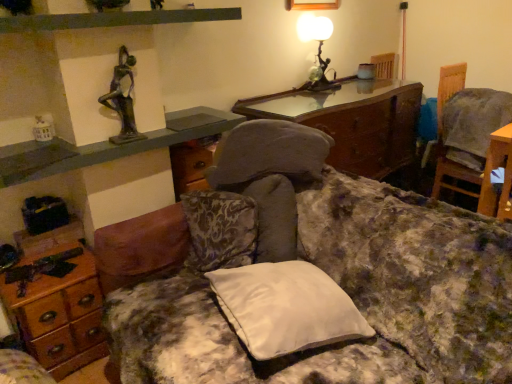
Question: Is fluffy fabric couch at center positioned before matte black shelf at upper left?

Choices:
 (A) yes
 (B) no

Answer: (A)

Question: Is matte black shelf at upper left at the back of fluffy fabric couch at center?

Choices:
 (A) yes
 (B) no

Answer: (B)

Question: Can you confirm if fluffy fabric couch at center is shorter than matte black shelf at upper left?

Choices:
 (A) no
 (B) yes

Answer: (A)

Question: Is fluffy fabric couch at center further to the viewer compared to matte black shelf at upper left?

Choices:
 (A) yes
 (B) no

Answer: (B)

Question: From a real-world perspective, does fluffy fabric couch at center sit lower than matte black shelf at upper left?

Choices:
 (A) yes
 (B) no

Answer: (A)

Question: Can you confirm if fluffy fabric couch at center is smaller than matte black shelf at upper left?

Choices:
 (A) no
 (B) yes

Answer: (A)

Question: Can you confirm if wooden desk at lower left is wider than matte glass table lamp at upper right?

Choices:
 (A) yes
 (B) no

Answer: (A)

Question: Can you confirm if wooden desk at lower left is thinner than matte glass table lamp at upper right?

Choices:
 (A) yes
 (B) no

Answer: (B)

Question: Is wooden desk at lower left outside matte glass table lamp at upper right?

Choices:
 (A) yes
 (B) no

Answer: (A)

Question: Could you tell me if wooden desk at lower left is facing matte glass table lamp at upper right?

Choices:
 (A) no
 (B) yes

Answer: (A)

Question: Is the depth of wooden desk at lower left greater than that of matte glass table lamp at upper right?

Choices:
 (A) yes
 (B) no

Answer: (B)

Question: From a real-world perspective, is wooden desk at lower left under matte glass table lamp at upper right?

Choices:
 (A) no
 (B) yes

Answer: (B)

Question: Does matte black shelf at upper left touch fluffy fabric couch at center?

Choices:
 (A) yes
 (B) no

Answer: (B)